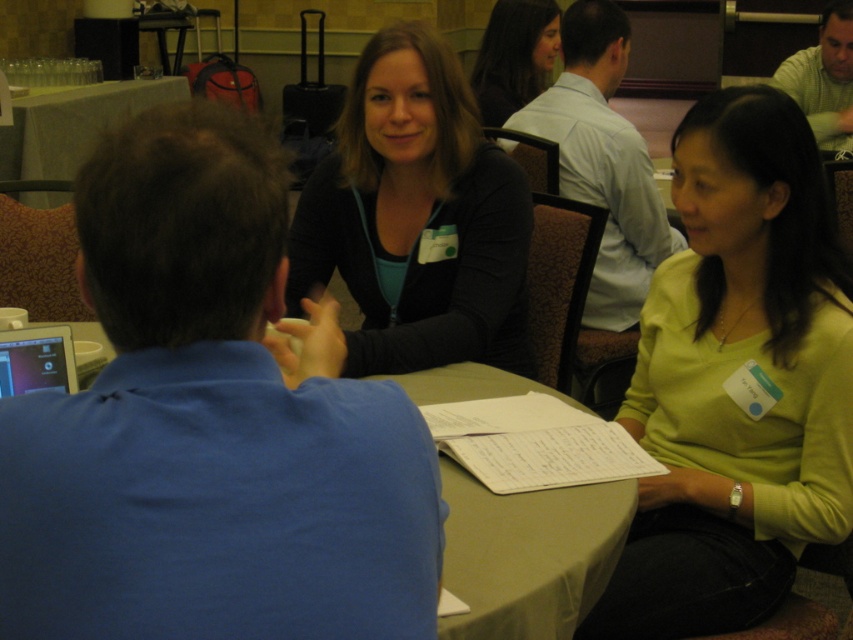
Based on the photo, you are sitting at a table in a meeting. You need to pass a document to the person wearing the matte black sweater at center without disturbing the person in the light blue shirt at center. Which direction should you pass it?

You should pass the document to the left side of the light blue shirt at center since the matte black sweater at center is located to the left of the light blue shirt at center.